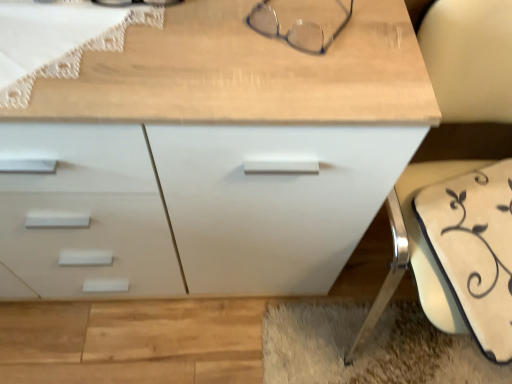
You are a GUI agent. You are given a task and a screenshot of the screen. Output one action in this format:
    pyautogui.click(x=<x>, y=<y>)
    Task: Click on the free space between white fabric swivel chair at lower right and white matte chest of drawers at center
    This screenshot has height=384, width=512.
    Given the screenshot: What is the action you would take?
    pyautogui.click(x=221, y=331)